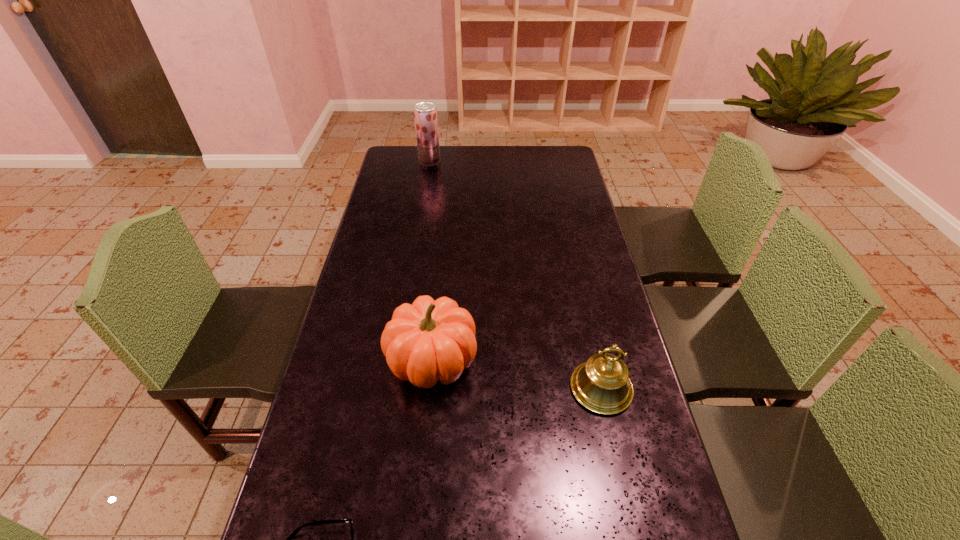
The width and height of the screenshot is (960, 540). Find the location of `object that is at the right edge`. object that is at the right edge is located at coordinates (601, 384).

I want to click on object that is at the far left corner, so click(425, 113).

You are a GUI agent. You are given a task and a screenshot of the screen. Output one action in this format:
    pyautogui.click(x=<x>, y=<y>)
    Task: Click on the free region at the far edge of the desktop
    
    Given the screenshot: What is the action you would take?
    point(509,172)

Where is `free region at the left edge of the desktop`? This screenshot has width=960, height=540. free region at the left edge of the desktop is located at coordinates (357, 279).

Find the location of a particular element. The image size is (960, 540). vacant space at the right edge of the desktop is located at coordinates (599, 286).

This screenshot has width=960, height=540. Identify the location of free space at the far right corner. pos(574,163).

Find the location of a particular element. The image size is (960, 540). empty space between the bell and the fruit juice is located at coordinates click(x=516, y=275).

Identify the location of empty location between the pumpkin and the fruit juice. (431, 261).

Where is `empty space that is in between the pumpkin and the third tallest object`? The width and height of the screenshot is (960, 540). empty space that is in between the pumpkin and the third tallest object is located at coordinates (516, 374).

Identify the location of object that is the third closest to the bell. pos(425,113).